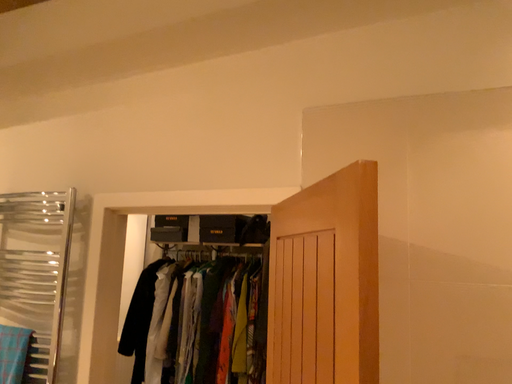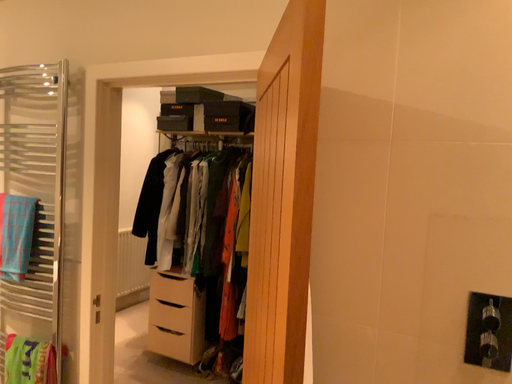
Question: How did the camera likely rotate when shooting the video?

Choices:
 (A) rotated upward
 (B) rotated downward

Answer: (B)